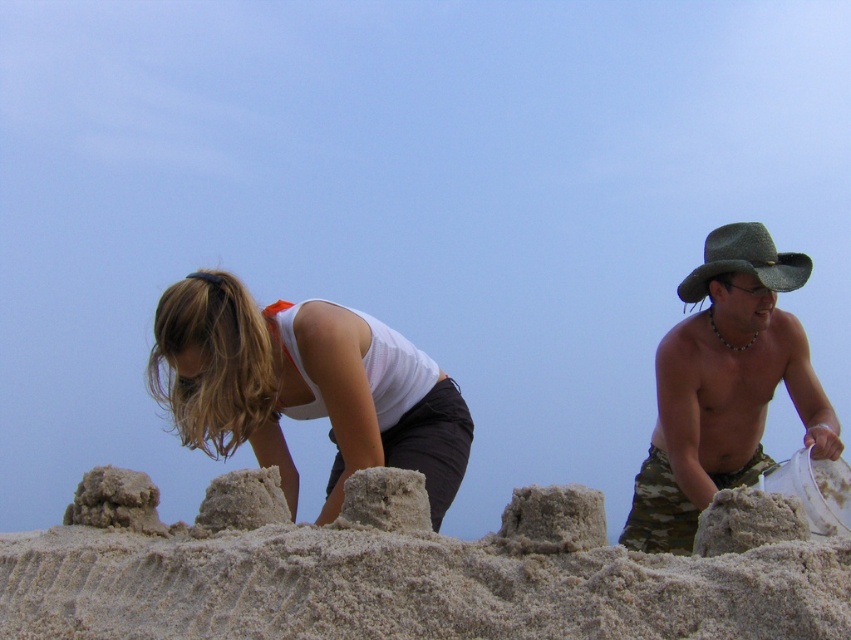
You are standing at the origin point of the image coordinate system. The camouflage shorts at right are located at point (724, 387). If you want to walk directly to the camouflage shorts at right, in which direction should you move?

The camouflage shorts at right are located at point (724, 387). Since the coordinate system is normalized, moving towards higher x and y values would mean moving to the right and upwards respectively. Therefore, to reach the camouflage shorts at right, you should move to the right and slightly upwards.

You are a photographer at the beach and want to capture a photo of both the camouflage shorts at right and the green felt cowboy hat at right. Since you want them both in the frame, which object should you place closer to the center of the photo to ensure both are visible?

Place the camouflage shorts at right closer to the center of the photo because it is positioned on the left side of the green felt cowboy hat at right, so centering the camouflage shorts at right will help include both in the frame.

You are a lifeguard observing the beach scene. You notice the white matte tank top at center and the camouflage shorts at right. Which clothing item appears smaller in the image?

The white matte tank top at center is smaller than the camouflage shorts at right.